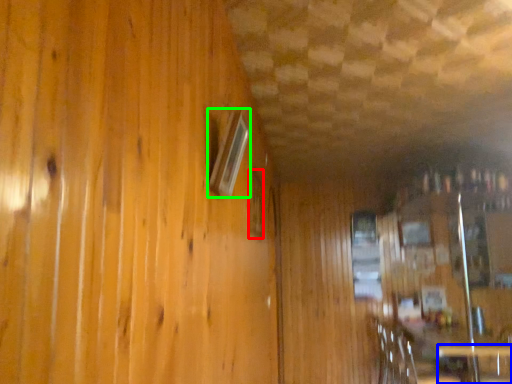
Question: Which object is positioned closest to window (highlighted by a red box)? Select from table (highlighted by a blue box) and window (highlighted by a green box).

Choices:
 (A) table
 (B) window

Answer: (B)